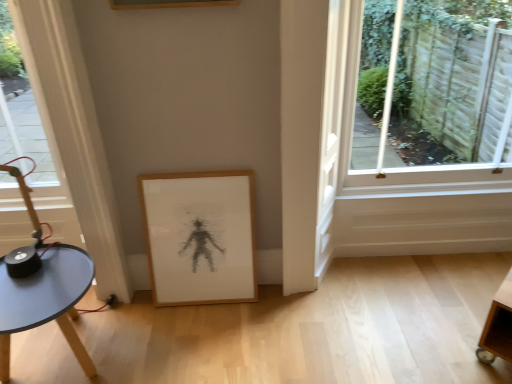
Question: Is clear glass window at upper right positioned beyond the bounds of matte blue table at lower left?

Choices:
 (A) yes
 (B) no

Answer: (A)

Question: Does clear glass window at upper right lie in front of matte blue table at lower left?

Choices:
 (A) yes
 (B) no

Answer: (B)

Question: Is clear glass window at upper right oriented towards matte blue table at lower left?

Choices:
 (A) yes
 (B) no

Answer: (B)

Question: From a real-world perspective, is clear glass window at upper right under matte blue table at lower left?

Choices:
 (A) yes
 (B) no

Answer: (B)

Question: Is clear glass window at upper right smaller than matte blue table at lower left?

Choices:
 (A) no
 (B) yes

Answer: (A)

Question: Relative to matte blue table at lower left, is wooden picture frame at lower center in front or behind?

Choices:
 (A) front
 (B) behind

Answer: (B)

Question: Considering the positions of wooden picture frame at lower center and matte blue table at lower left in the image, is wooden picture frame at lower center wider or thinner than matte blue table at lower left?

Choices:
 (A) wide
 (B) thin

Answer: (B)

Question: Do you think wooden picture frame at lower center is within matte blue table at lower left, or outside of it?

Choices:
 (A) outside
 (B) inside

Answer: (A)

Question: Is wooden picture frame at lower center taller or shorter than matte blue table at lower left?

Choices:
 (A) tall
 (B) short

Answer: (A)

Question: Considering the positions of clear glass window at upper right and matte blue table at lower left in the image, is clear glass window at upper right bigger or smaller than matte blue table at lower left?

Choices:
 (A) big
 (B) small

Answer: (A)

Question: Is clear glass window at upper right spatially inside matte blue table at lower left, or outside of it?

Choices:
 (A) outside
 (B) inside

Answer: (A)

Question: In terms of height, does clear glass window at upper right look taller or shorter compared to matte blue table at lower left?

Choices:
 (A) tall
 (B) short

Answer: (A)

Question: Is clear glass window at upper right wider or thinner than matte blue table at lower left?

Choices:
 (A) wide
 (B) thin

Answer: (B)

Question: Would you say clear glass window at upper right is inside or outside wooden picture frame at lower center?

Choices:
 (A) inside
 (B) outside

Answer: (B)

Question: In terms of width, does clear glass window at upper right look wider or thinner when compared to wooden picture frame at lower center?

Choices:
 (A) thin
 (B) wide

Answer: (B)